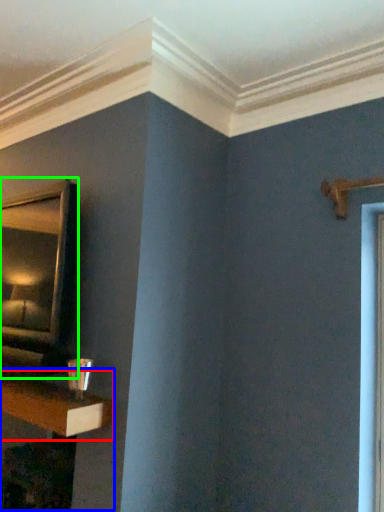
Question: Estimate the real-world distances between objects in this image. Which object is farther from shelf (highlighted by a red box), table (highlighted by a blue box) or mirror (highlighted by a green box)?

Choices:
 (A) table
 (B) mirror

Answer: (B)